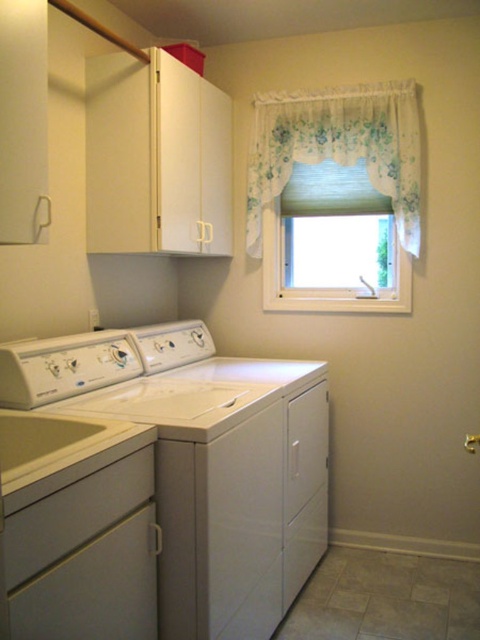
Question: Does white glossy washing machine at lower left have a greater width compared to white glossy sink at lower left?

Choices:
 (A) yes
 (B) no

Answer: (A)

Question: Is white glossy washing machine at lower left positioned before white glossy sink at lower left?

Choices:
 (A) yes
 (B) no

Answer: (B)

Question: Which object appears closest to the camera in this image?

Choices:
 (A) white matte washing machine at center
 (B) white glossy sink at lower left

Answer: (B)

Question: Based on their relative distances, which object is nearer to the white glossy washing machine at lower left?

Choices:
 (A) white matte washing machine at center
 (B) floral lace curtain at upper center
 (C) white glossy sink at lower left

Answer: (A)

Question: Is white glossy washing machine at lower left bigger than floral lace curtain at upper center?

Choices:
 (A) no
 (B) yes

Answer: (B)

Question: Which point appears closest to the camera in this image?

Choices:
 (A) (251, 221)
 (B) (44, 435)
 (C) (167, 544)

Answer: (C)